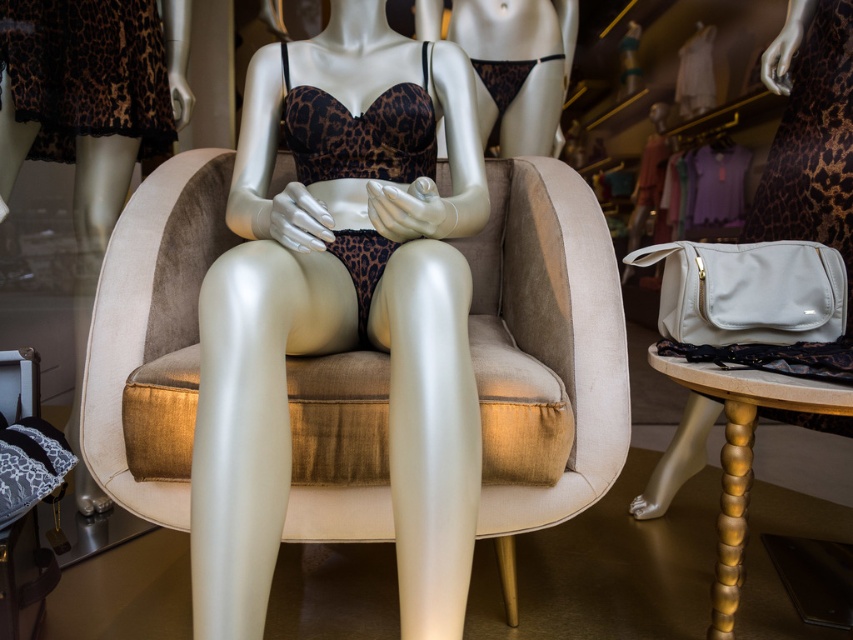
Which is more to the left, leopard print fabric bra and panties at center or beige velvet armchair at center?

Positioned to the left is beige velvet armchair at center.

How distant is leopard print fabric bra and panties at center from beige velvet armchair at center?

leopard print fabric bra and panties at center is 25.07 centimeters from beige velvet armchair at center.

This screenshot has width=853, height=640. In order to click on leopard print fabric bra and panties at center in this screenshot , I will do `click(338, 349)`.